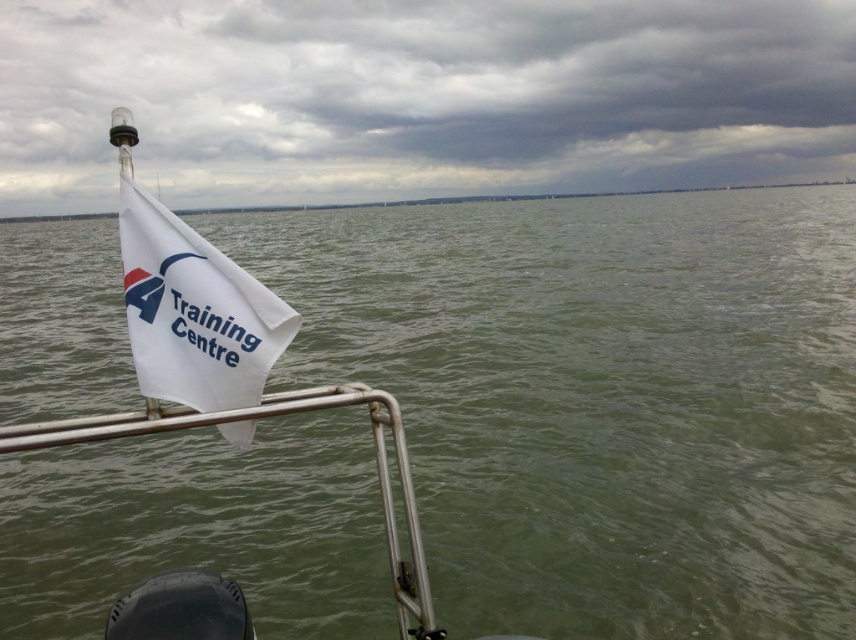
Question: Which point is closer to the camera taking this photo?

Choices:
 (A) (13, 509)
 (B) (180, 378)
 (C) (687, 40)

Answer: (B)

Question: Is white flag at left to the left of white fabric flag at left from the viewer's perspective?

Choices:
 (A) no
 (B) yes

Answer: (B)

Question: Based on their relative distances, which object is farther from the white flag at left?

Choices:
 (A) green water at center
 (B) white fabric flag at left

Answer: (B)

Question: Is green water at center behind white fabric flag at left?

Choices:
 (A) no
 (B) yes

Answer: (B)

Question: Which of the following is the farthest from the observer?

Choices:
 (A) white flag at left
 (B) white fabric flag at left
 (C) green water at center

Answer: (A)

Question: Does green water at center appear under white fabric flag at left?

Choices:
 (A) no
 (B) yes

Answer: (A)